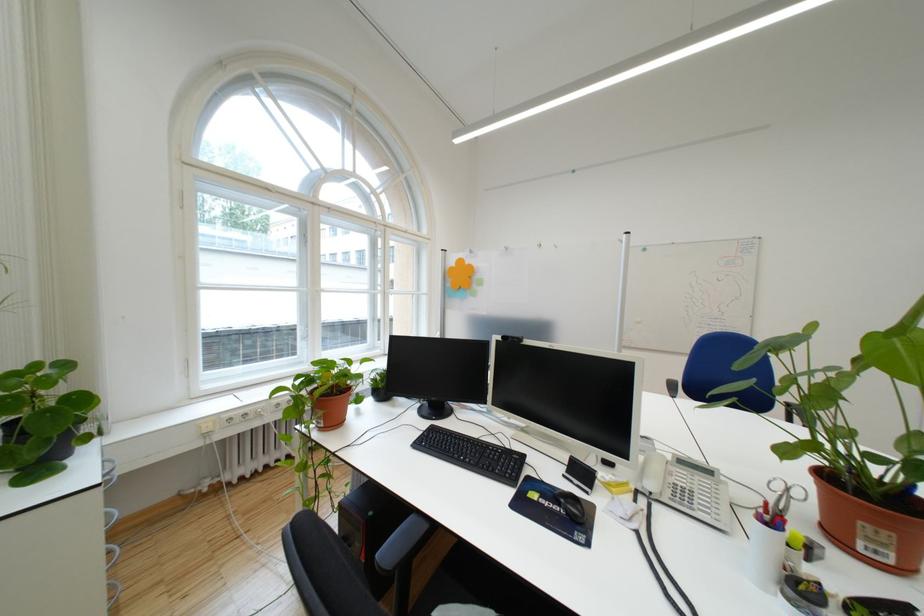
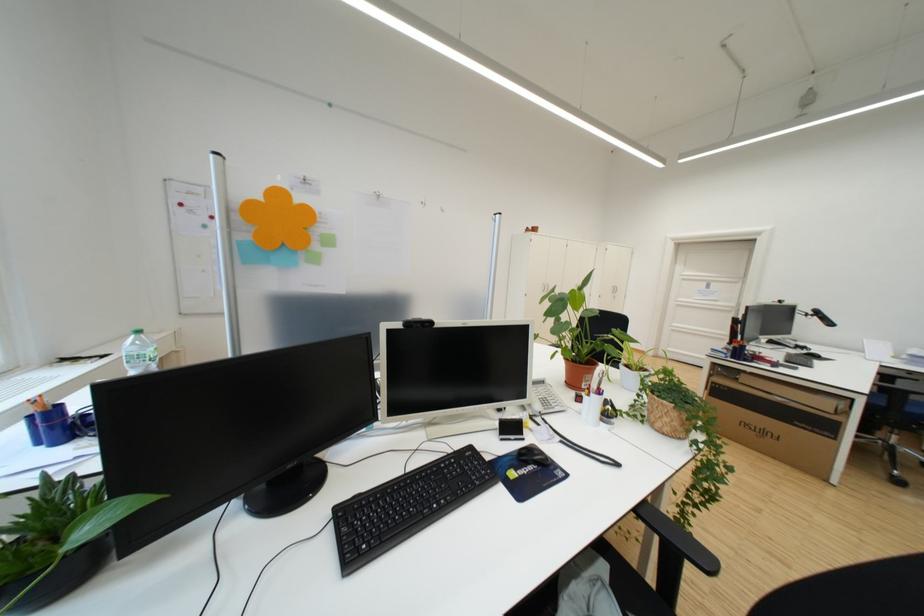
Find the pixel in the second image that matches point (648, 504) in the first image.

(551, 426)